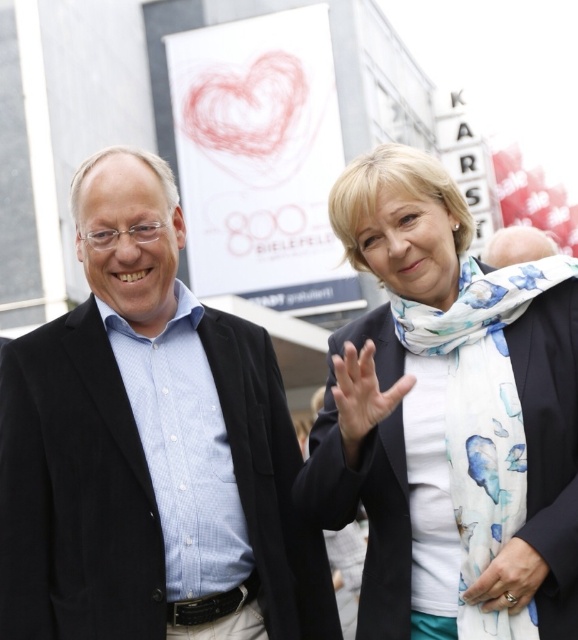
Question: Is white floral scarf at upper center positioned at the back of gold ring at center?

Choices:
 (A) no
 (B) yes

Answer: (B)

Question: From the image, what is the correct spatial relationship of blue shirt at center in relation to gold ring at center?

Choices:
 (A) left
 (B) right

Answer: (A)

Question: Which object appears farthest from the camera in this image?

Choices:
 (A) gold ring at center
 (B) matte black jacket at center

Answer: (B)

Question: Is blue shirt at center smaller than gold ring at center?

Choices:
 (A) yes
 (B) no

Answer: (B)

Question: Which of the following is the closest to the observer?

Choices:
 (A) (346, 420)
 (B) (527, 602)
 (C) (173, 468)
 (D) (533, 560)

Answer: (D)

Question: Considering the real-world distances, which object is closest to the white floral scarf at center?

Choices:
 (A) blue shirt at center
 (B) gold ring at center

Answer: (B)